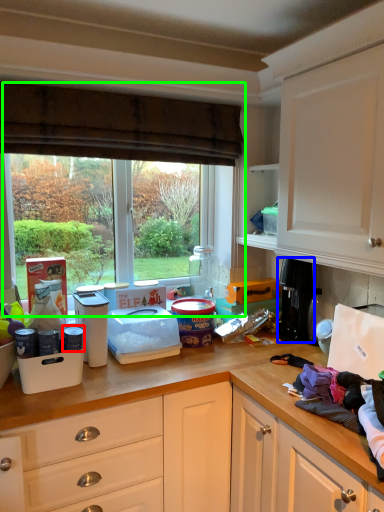
Question: Which is nearer to the appliance (highlighted by a red box)? appliance (highlighted by a blue box) or window (highlighted by a green box).

Choices:
 (A) appliance
 (B) window

Answer: (B)